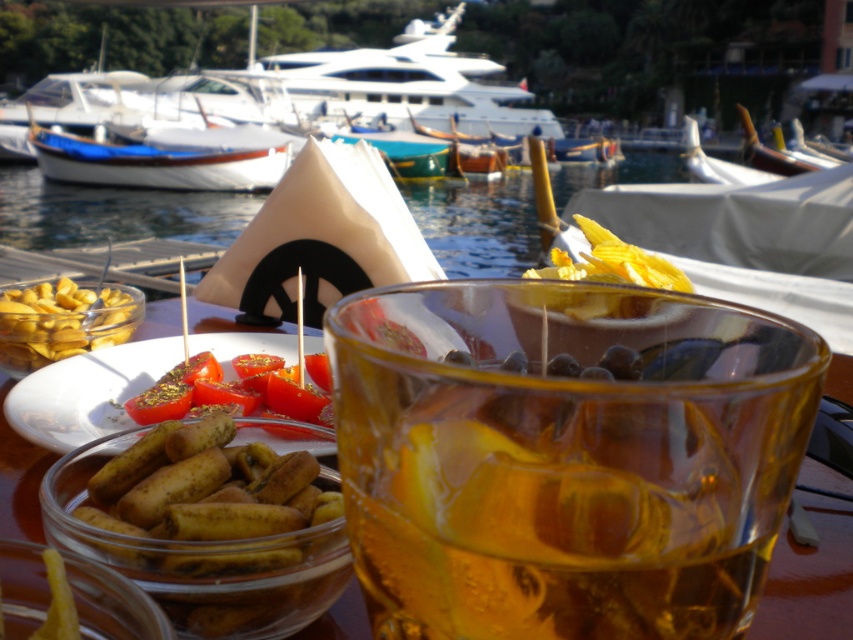
You are a bartender at the marina and need to prepare a drink for a customer. You have a glass that can hold up to 150ml. The translucent amber liquid at center is the drink base. If the yellow matte olives at lower left are to be added as garnish, will the glass overflow?

The translucent amber liquid at center has a larger width than the yellow matte olives at lower left. However, width does not directly indicate volume. Since the question involves capacity and the provided information only specifies width, it cannot be determined if the glass will overflow based on the given details.

You are a photographer trying to capture the entire scene. You notice two points in the image at coordinates point (625, 564) and point (79, 296). Which point should you focus on first to ensure both points are in sharp focus?

You should focus on point (625, 564) first because it is closer to the camera than point (79, 296), ensuring both points are within the depth of field.